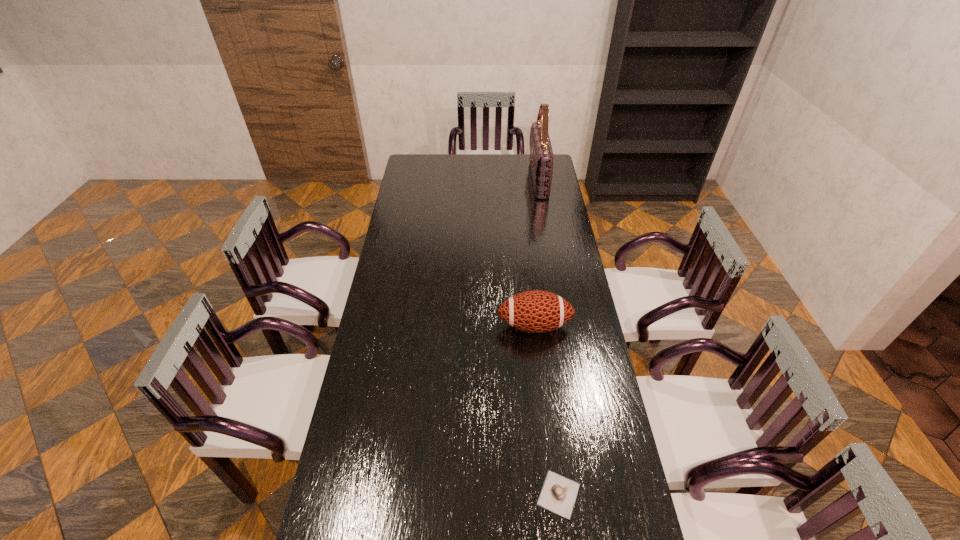
Locate an element on the screen. vacant space situated on the right of the garlic is located at coordinates (633, 494).

You are a GUI agent. You are given a task and a screenshot of the screen. Output one action in this format:
    pyautogui.click(x=<x>, y=<y>)
    Task: Click on the object positioned at the far edge
    This screenshot has width=960, height=540.
    Given the screenshot: What is the action you would take?
    pyautogui.click(x=541, y=155)

Identify the location of handbag at the right edge. (541, 155).

The width and height of the screenshot is (960, 540). What are the coordinates of `football at the right edge` in the screenshot? It's located at (536, 311).

This screenshot has height=540, width=960. Identify the location of garlic located at the right edge. (558, 494).

Identify the location of object that is at the far right corner. The height and width of the screenshot is (540, 960). pos(541,155).

This screenshot has width=960, height=540. I want to click on free spot at the far edge of the desktop, so click(x=450, y=167).

Find the location of a particular element. This screenshot has width=960, height=540. free space at the left edge of the desktop is located at coordinates (367, 354).

Locate an element on the screen. Image resolution: width=960 pixels, height=540 pixels. vacant space at the right edge of the desktop is located at coordinates (x=554, y=219).

Where is `free spot between the football and the handbag`? free spot between the football and the handbag is located at coordinates (537, 252).